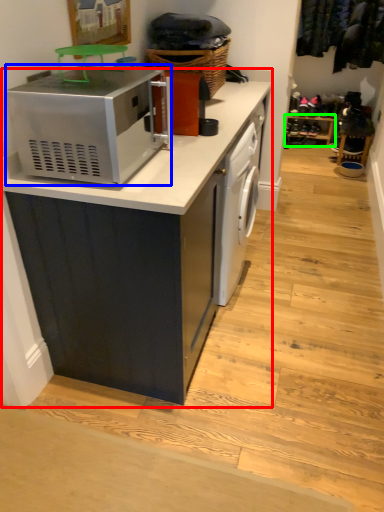
Question: Which object is the closest to the cabinetry (highlighted by a red box)? Choose among these: home appliance (highlighted by a blue box) or shelf (highlighted by a green box).

Choices:
 (A) home appliance
 (B) shelf

Answer: (A)